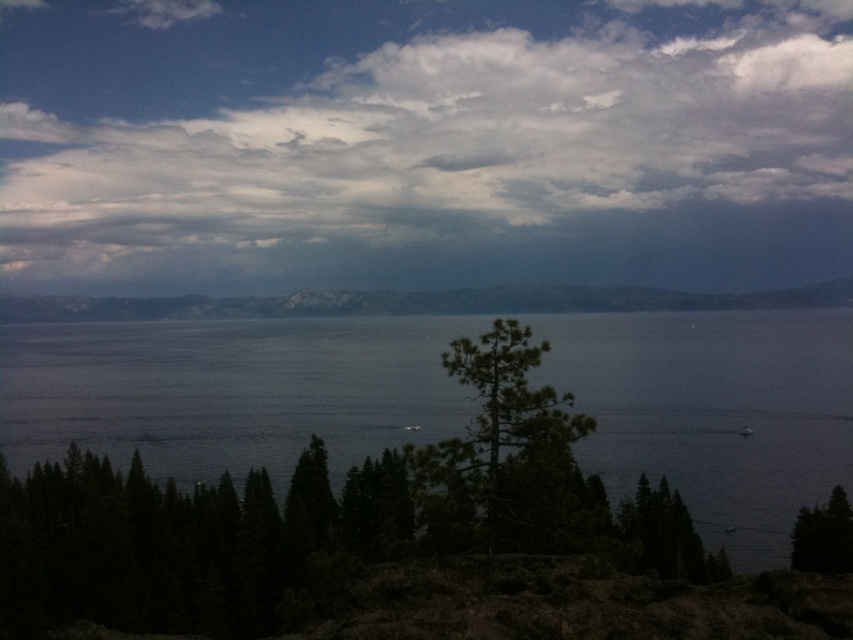
You are standing in the serene landscape and want to take a photo of the cloudy sky at upper center and the green matte tree at lower right. Which object will appear larger in the photo?

The green matte tree at lower right will appear larger in the photo because it is closer to the camera than the cloudy sky at upper center.